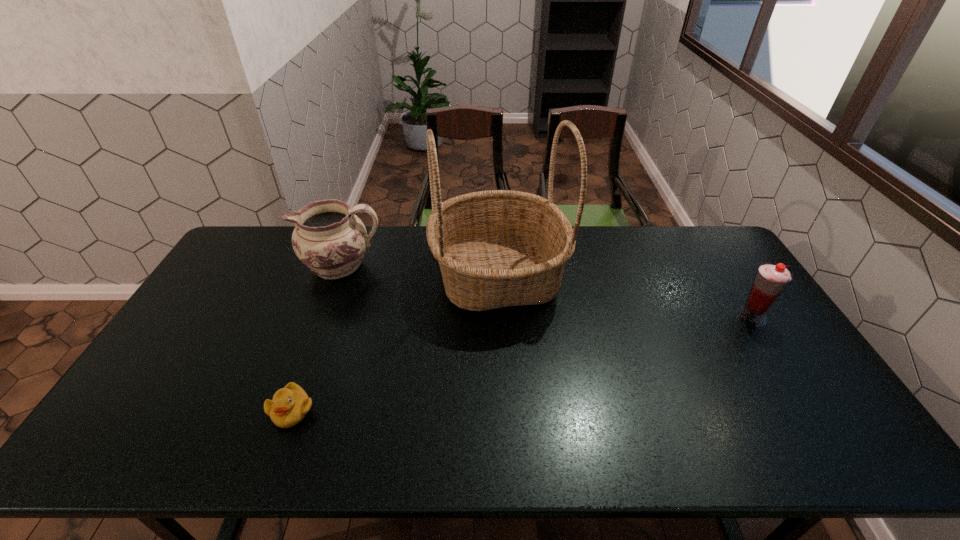
This screenshot has width=960, height=540. Find the location of `vacant area situated 0.390m on the left of the rightmost object`. vacant area situated 0.390m on the left of the rightmost object is located at coordinates (609, 316).

At what (x,y) coordinates should I click in order to perform the action: click on free space located 0.070m at the beak of the shortest object. Please return your answer as a coordinate pair (x, y). Looking at the image, I should click on (275, 459).

This screenshot has height=540, width=960. What are the coordinates of `basket that is positioned at the far edge` in the screenshot? It's located at (496, 248).

At what (x,y) coordinates should I click in order to perform the action: click on pitcher that is at the far edge. Please return your answer as a coordinate pair (x, y). Image resolution: width=960 pixels, height=540 pixels. Looking at the image, I should click on (329, 239).

Find the location of a particular element. Image resolution: width=960 pixels, height=540 pixels. object that is at the near edge is located at coordinates (289, 406).

Where is `object at the right edge`? The image size is (960, 540). object at the right edge is located at coordinates (771, 279).

Identify the location of free space at the far edge of the desktop. The width and height of the screenshot is (960, 540). click(407, 233).

This screenshot has height=540, width=960. In the image, there is a desktop. In order to click on free region at the near edge in this screenshot , I will do `click(392, 446)`.

Locate an element on the screen. This screenshot has width=960, height=540. free region at the left edge is located at coordinates (206, 303).

Locate an element on the screen. This screenshot has width=960, height=540. blank space at the right edge is located at coordinates (778, 357).